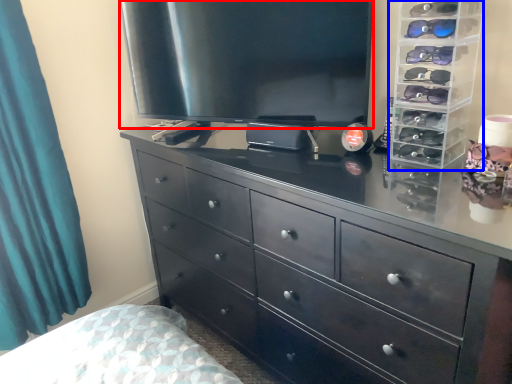
Question: Which point is closer to the camera, television (highlighted by a red box) or tv cabinet (highlighted by a blue box)?

Choices:
 (A) television
 (B) tv cabinet

Answer: (B)